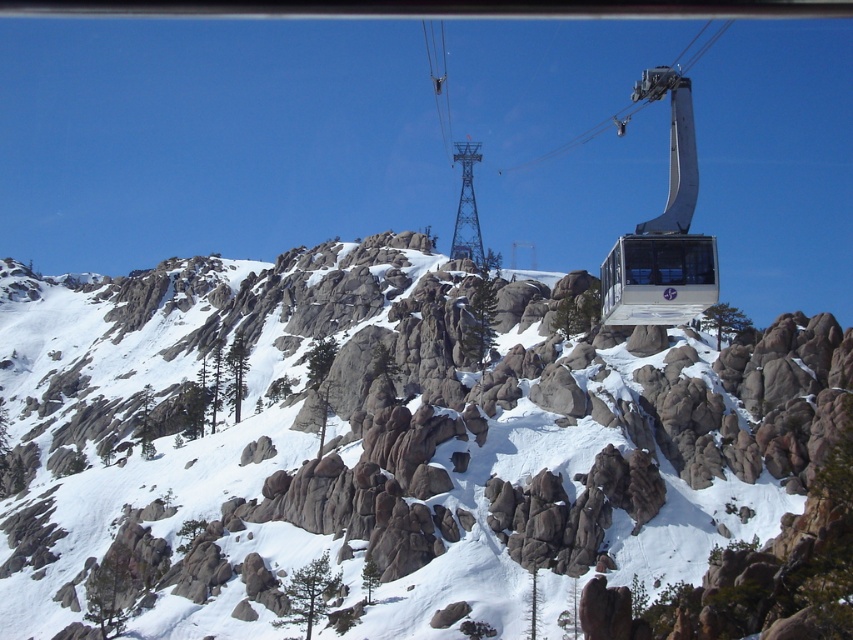
Does metallic silver gondola at center have a greater height compared to metallic silver cable car at center?

Yes.

At what (x,y) coordinates should I click in order to perform the action: click on metallic silver gondola at center. Please return your answer as a coordinate pair (x, y). The image size is (853, 640). Looking at the image, I should click on (669, 141).

Is point (698, 292) positioned after point (631, 301)?

No, it is not.

This screenshot has height=640, width=853. Identify the location of metallic silver gondola at center. (669, 141).

Is snowy granite mountain at center taller than metallic silver gondola at center?

Incorrect, snowy granite mountain at center's height is not larger of metallic silver gondola at center's.

Is snowy granite mountain at center smaller than metallic silver gondola at center?

Yes.

Is point (816, 548) positioned before point (672, 97)?

That is True.

The image size is (853, 640). I want to click on snowy granite mountain at center, so click(401, 456).

Which is in front, point (463, 337) or point (628, 234)?

Positioned in front is point (463, 337).

Does snowy granite mountain at center appear on the right side of metallic silver cable car at center?

Incorrect, snowy granite mountain at center is not on the right side of metallic silver cable car at center.

Which is in front, point (457, 300) or point (662, 276)?

Point (662, 276) is more forward.

This screenshot has height=640, width=853. Find the location of `snowy granite mountain at center`. snowy granite mountain at center is located at coordinates tap(401, 456).